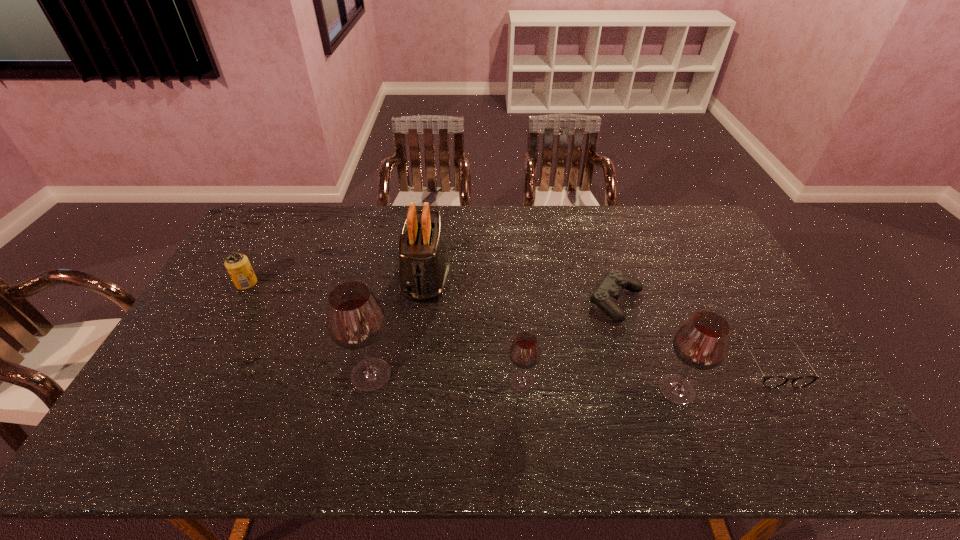
Locate an element on the screen. the leftmost wineglass is located at coordinates (355, 320).

Image resolution: width=960 pixels, height=540 pixels. I want to click on the shortest wineglass, so pos(524,353).

At what (x,y) coordinates should I click in order to perform the action: click on the fourth object from right to left. Please return your answer as a coordinate pair (x, y). The height and width of the screenshot is (540, 960). Looking at the image, I should click on (524, 353).

Where is `the rightmost wineglass`? the rightmost wineglass is located at coordinates (701, 343).

Where is `beer can`? The width and height of the screenshot is (960, 540). beer can is located at coordinates (238, 266).

The width and height of the screenshot is (960, 540). I want to click on the leftmost object, so click(238, 266).

Find the location of a particular element. Image resolution: width=960 pixels, height=540 pixels. the sixth tallest object is located at coordinates (605, 296).

Where is `toaster`? The image size is (960, 540). toaster is located at coordinates (424, 264).

Locate an element on the screen. The height and width of the screenshot is (540, 960). the rightmost object is located at coordinates [x=769, y=381].

Where is `the shortest object`? the shortest object is located at coordinates (769, 381).